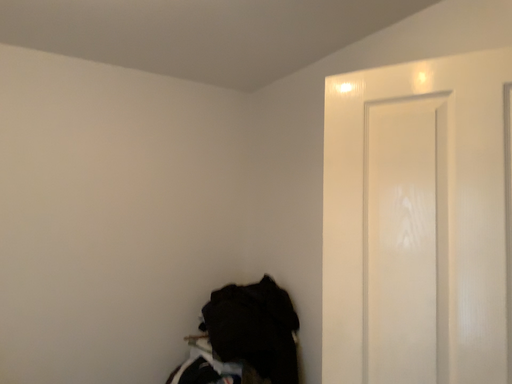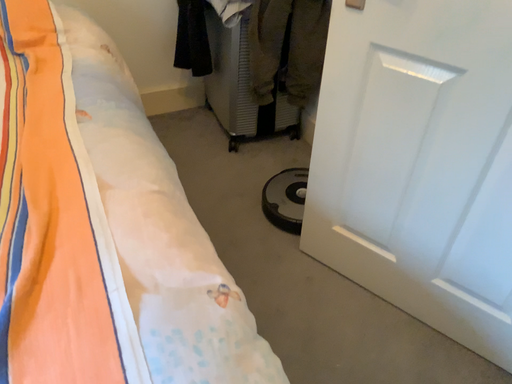
Question: How did the camera likely rotate when shooting the video?

Choices:
 (A) rotated right
 (B) rotated left

Answer: (B)